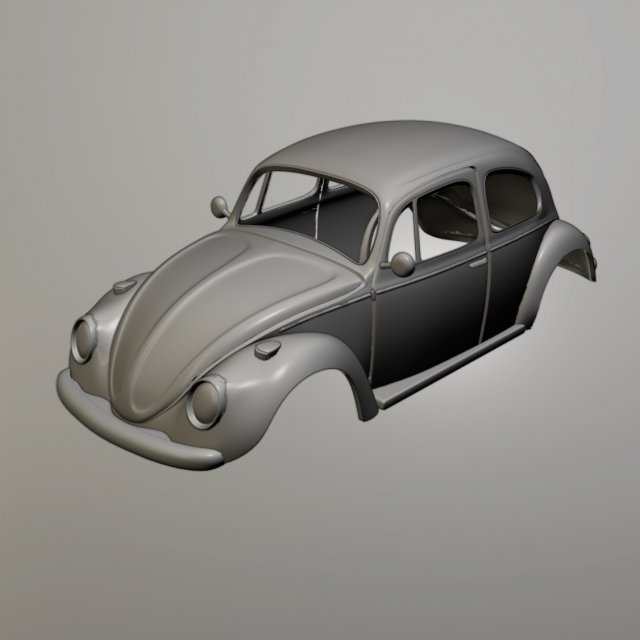
I want to click on door handle, so click(475, 264).